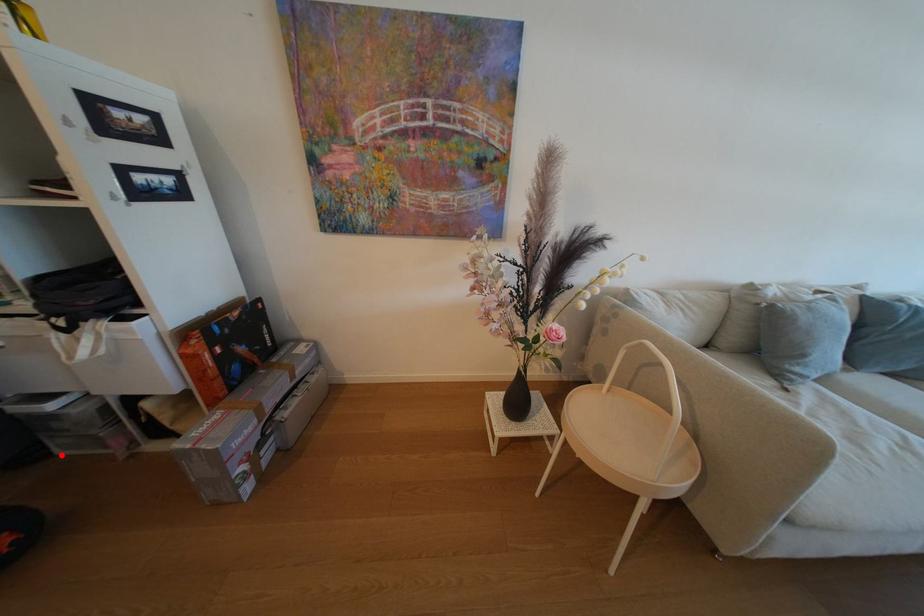
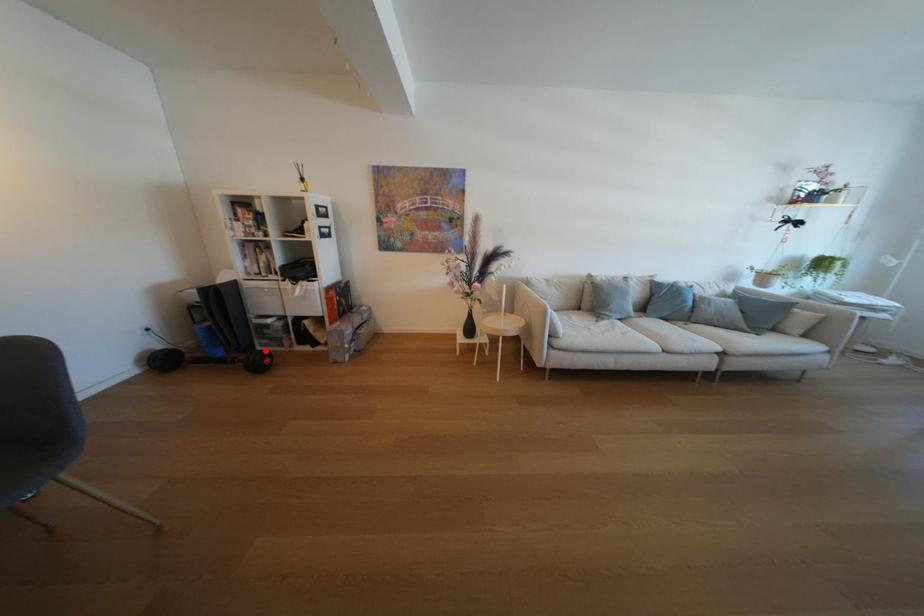
I am providing you with two images of the same scene from different viewpoints. A red point is marked on the first image and another point is marked on the second image. Are the points marked in image1 and image2 representing the same 3D position?

Yes